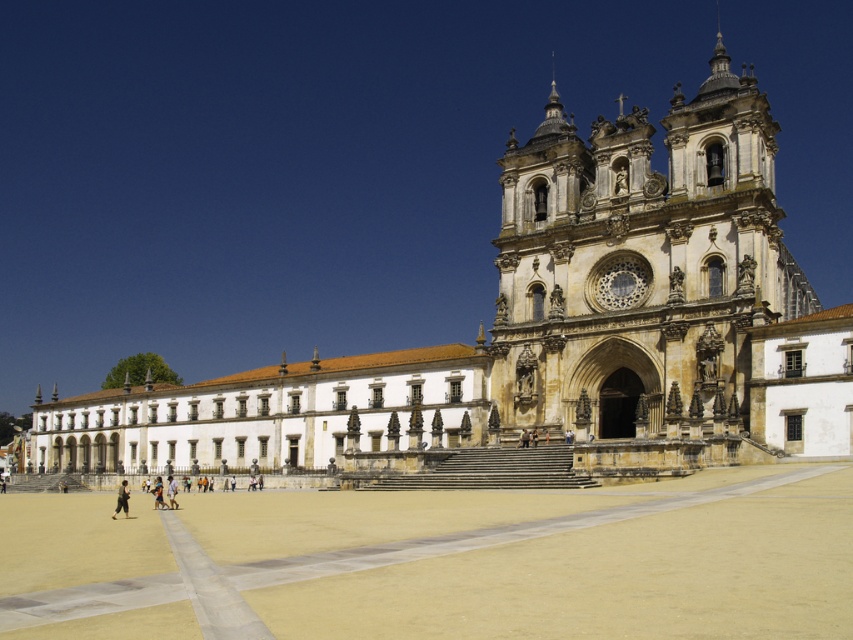
Question: Based on their relative distances, which object is farther from the white stone church at center?

Choices:
 (A) beige stone tower at center
 (B) dark gray fabric pants at lower left

Answer: (B)

Question: Can you confirm if white stone church at center is thinner than dark gray fabric pants at lower left?

Choices:
 (A) no
 (B) yes

Answer: (A)

Question: Is beige stone tower at center in front of dark gray fabric pants at lower left?

Choices:
 (A) no
 (B) yes

Answer: (A)

Question: Can you confirm if white stone church at center is positioned below beige stone tower at center?

Choices:
 (A) yes
 (B) no

Answer: (B)

Question: Among these objects, which one is farthest from the camera?

Choices:
 (A) white stone church at center
 (B) beige stone tower at center

Answer: (A)

Question: Estimate the real-world distances between objects in this image. Which object is closer to the beige stone tower at center?

Choices:
 (A) white stone church at center
 (B) dark gray fabric pants at lower left

Answer: (A)